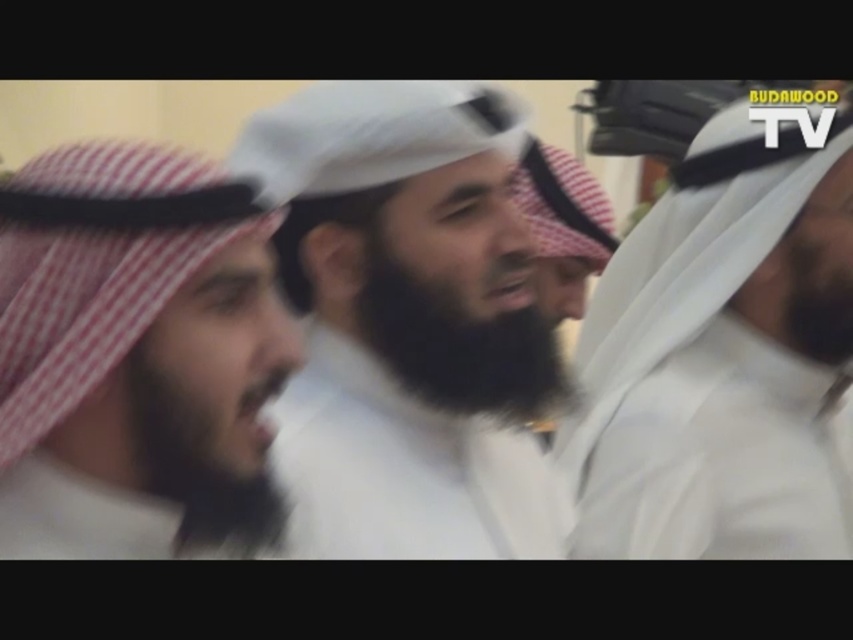
Does white matte headscarf at right appear over black fuzzy beard at center?

Yes.

Is white matte headscarf at right positioned behind black fuzzy beard at center?

Yes, it is.

In order to click on white matte headscarf at right in this screenshot , I will do `click(724, 353)`.

At what (x,y) coordinates should I click in order to perform the action: click on white matte headscarf at right. Please return your answer as a coordinate pair (x, y). This screenshot has height=640, width=853. Looking at the image, I should click on (724, 353).

Can you confirm if black fuzzy beard at center is positioned below black fuzzy beard at left?

Incorrect, black fuzzy beard at center is not positioned below black fuzzy beard at left.

Is black fuzzy beard at center above black fuzzy beard at left?

Yes, black fuzzy beard at center is above black fuzzy beard at left.

Find the location of `black fuzzy beard at center`. black fuzzy beard at center is located at coordinates (456, 342).

Can you confirm if white matte headscarf at right is positioned to the left of black fuzzy beard at left?

No, white matte headscarf at right is not to the left of black fuzzy beard at left.

You are a GUI agent. You are given a task and a screenshot of the screen. Output one action in this format:
    pyautogui.click(x=<x>, y=<y>)
    Task: Click on the white matte headscarf at right
    The image size is (853, 640).
    Given the screenshot: What is the action you would take?
    pyautogui.click(x=724, y=353)

At what (x,y) coordinates should I click in order to perform the action: click on white matte headscarf at right. Please return your answer as a coordinate pair (x, y). Looking at the image, I should click on (724, 353).